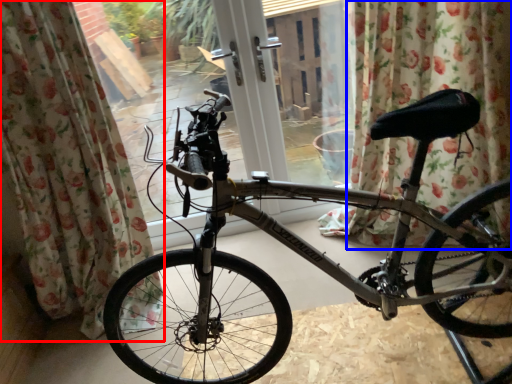
Question: Among these objects, which one is nearest to the camera, curtain (highlighted by a red box) or curtain (highlighted by a blue box)?

Choices:
 (A) curtain
 (B) curtain

Answer: (A)